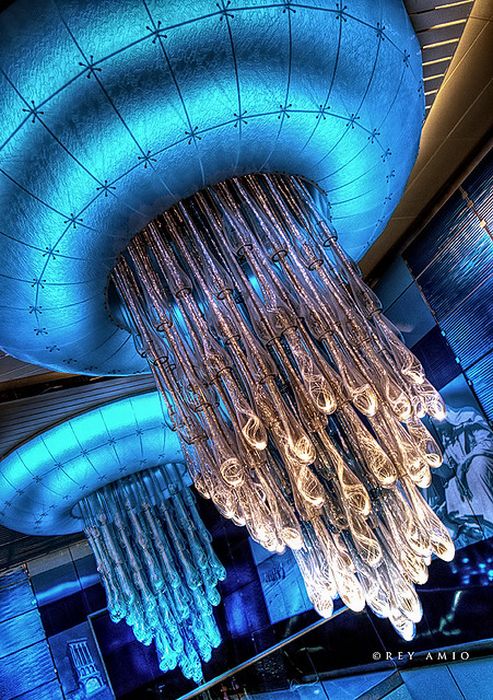
Identify the location of chandelier. (305, 449), (166, 623).